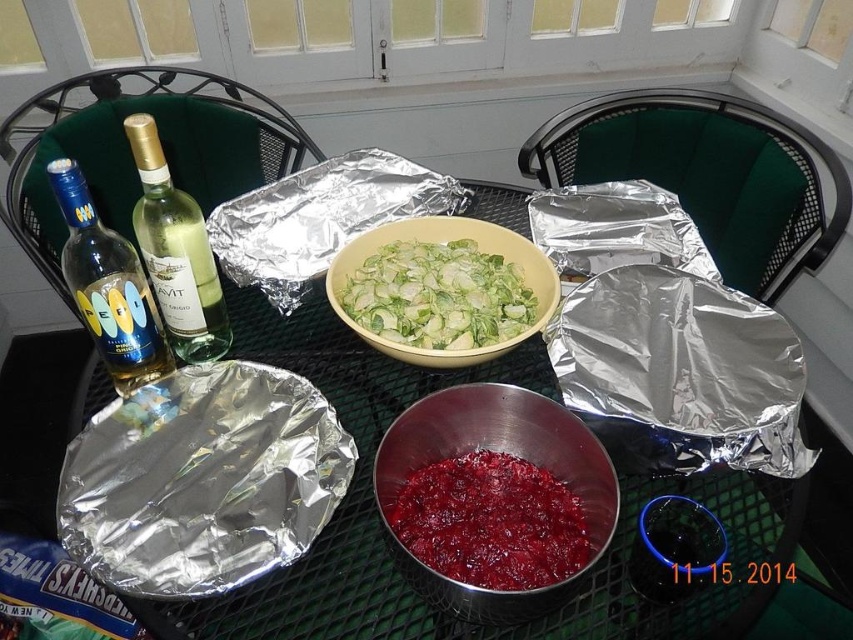
Based on the photo, you are planning to serve a salad and a main course at the table. The salad will go in the metallic silver bowl at lower center and the main course in the yellow matte bowl at center. Which bowl will require a larger surface area on the table?

The yellow matte bowl at center requires a larger surface area because it is bigger than the metallic silver bowl at lower center.

You are setting up a picnic and have two bowls on the table. The metallic silver bowl at lower center and the yellow matte bowl at center. Which bowl should you choose if you need a taller container for a salad?

The yellow matte bowl at center is taller than the metallic silver bowl at lower center, so you should choose the yellow matte bowl at center for the salad.

You are planning to place a small plate on the table between the metallic foil at center and the metallic silver bowl at lower center. Based on their sizes, which object should you place the plate closer to to ensure it fits properly?

The metallic foil at center might be wider than the metallic silver bowl at lower center, so placing the plate closer to the metallic silver bowl at lower center would provide more space for the plate to fit properly.